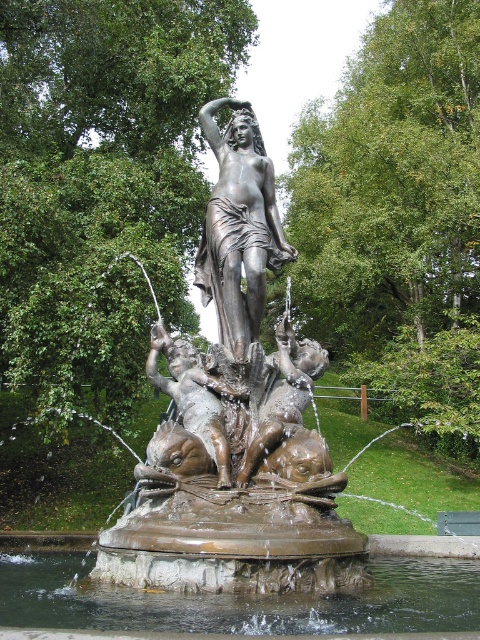
You are an art student analyzing the fountain sculpture. You notice the shiny bronze statue at center and the bronze cherub at center. Which of these two objects is wider?

The shiny bronze statue at center is wider than the bronze cherub at center.

You are standing at the center of the circular base of the fountain sculpture. You notice two points marked on the ground at coordinates point (261, 161) and point (156, 364). Which point is closer to you?

Point (156, 364) is closer to you because it is in front of point (261, 161).